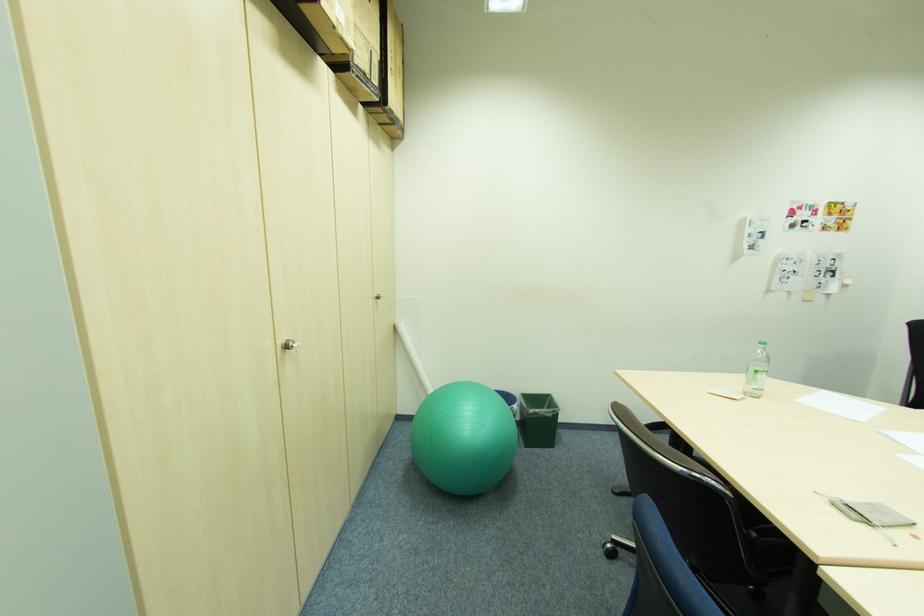
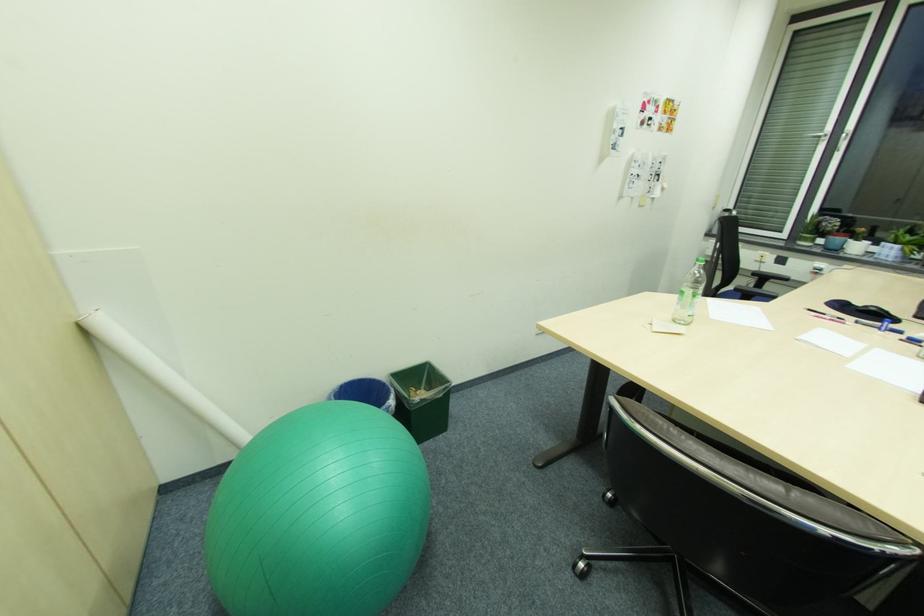
Where in the second image is the point corresponding to [759,395] from the first image?

(688, 323)